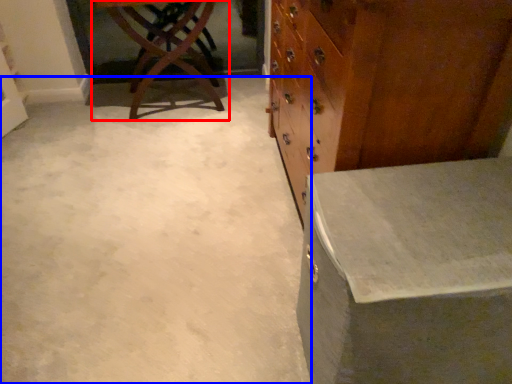
Question: Among these objects, which one is farthest to the camera, table (highlighted by a red box) or concrete (highlighted by a blue box)?

Choices:
 (A) table
 (B) concrete

Answer: (A)